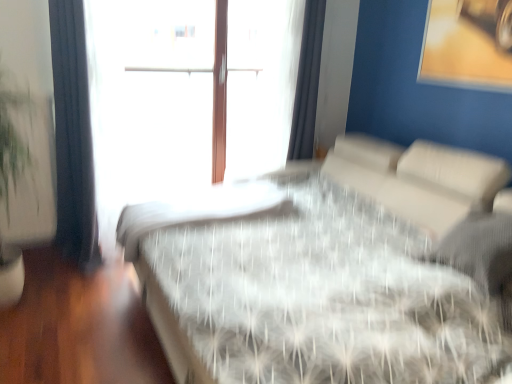
Question: Can you confirm if white textured mattress at center is smaller than white sheer curtain at upper right, placed as the first curtain when sorted from back to front?

Choices:
 (A) no
 (B) yes

Answer: (A)

Question: Can you confirm if white textured mattress at center is shorter than white sheer curtain at upper right, arranged as the 1th curtain when viewed from the right?

Choices:
 (A) yes
 (B) no

Answer: (A)

Question: Is white textured mattress at center aimed at white sheer curtain at upper right, arranged as the 1th curtain when viewed from the right?

Choices:
 (A) yes
 (B) no

Answer: (B)

Question: Is white textured mattress at center wider than white sheer curtain at upper right, which is counted as the second curtain, starting from the left?

Choices:
 (A) yes
 (B) no

Answer: (A)

Question: From a real-world perspective, is white textured mattress at center below white sheer curtain at upper right, arranged as the 1th curtain when viewed from the right?

Choices:
 (A) no
 (B) yes

Answer: (B)

Question: Is the depth of white textured mattress at center greater than that of white sheer curtain at upper right, the 2th curtain viewed from the front?

Choices:
 (A) no
 (B) yes

Answer: (A)

Question: Does dark blue fabric curtain at left, which appears as the first curtain when viewed from the front, touch white textured bed at center?

Choices:
 (A) no
 (B) yes

Answer: (A)

Question: Is dark blue fabric curtain at left, the second curtain from the right, closer to camera compared to white textured bed at center?

Choices:
 (A) yes
 (B) no

Answer: (B)

Question: Is dark blue fabric curtain at left, which appears as the second curtain when viewed from the back, positioned with its back to white textured bed at center?

Choices:
 (A) yes
 (B) no

Answer: (B)

Question: Does dark blue fabric curtain at left, which appears as the second curtain when viewed from the back, have a smaller size compared to white textured bed at center?

Choices:
 (A) no
 (B) yes

Answer: (B)

Question: From a real-world perspective, is dark blue fabric curtain at left, placed as the first curtain when sorted from left to right, under white textured bed at center?

Choices:
 (A) yes
 (B) no

Answer: (B)

Question: From a real-world perspective, is dark blue fabric curtain at left, placed as the first curtain when sorted from left to right, located higher than white textured bed at center?

Choices:
 (A) no
 (B) yes

Answer: (B)

Question: Is there a large distance between white sheer curtain at upper right, placed as the first curtain when sorted from back to front, and white textured bed at center?

Choices:
 (A) yes
 (B) no

Answer: (A)